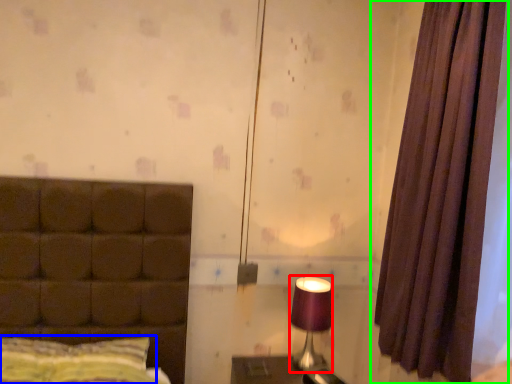
Question: Which object is the closest to the table lamp (highlighted by a red box)? Choose among these: pillow (highlighted by a blue box) or curtain (highlighted by a green box).

Choices:
 (A) pillow
 (B) curtain

Answer: (B)